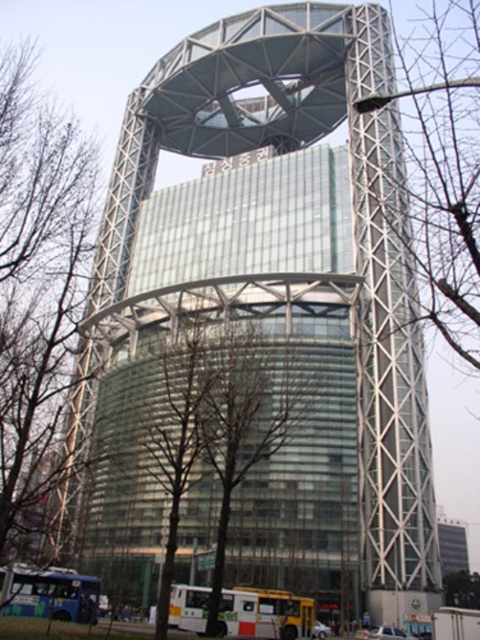
Question: Which point is closer to the camera?

Choices:
 (A) bare branches at center
 (B) green leafy tree at center

Answer: (A)

Question: From the image, what is the correct spatial relationship of white matte ambulance at lower center in relation to green leafy tree at center?

Choices:
 (A) below
 (B) above

Answer: (B)

Question: Is white matte ambulance at lower center thinner than green leafy tree at center?

Choices:
 (A) yes
 (B) no

Answer: (B)

Question: Which of the following is the closest to the observer?

Choices:
 (A) (272, 451)
 (B) (444, 580)

Answer: (A)

Question: Is bare branches at center wider than white matte ambulance at lower center?

Choices:
 (A) yes
 (B) no

Answer: (B)

Question: Based on their relative distances, which object is farther from the white matte ambulance at lower center?

Choices:
 (A) bare branches at center
 (B) green leafy tree at center

Answer: (B)